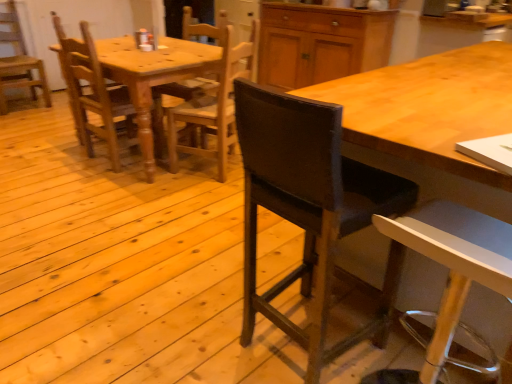
Question: From the image's perspective, is wooden desk at center above or below dark brown leather chair at center, which is counted as the fourth chair, starting from the left?

Choices:
 (A) above
 (B) below

Answer: (A)

Question: Does point (453, 62) appear closer or farther from the camera than point (287, 173)?

Choices:
 (A) farther
 (B) closer

Answer: (A)

Question: Which object is positioned farthest from the wooden chair at center, positioned as the fourth chair in right-to-left order?

Choices:
 (A) wooden chair at center, acting as the 3th chair starting from the right
 (B) white plastic stool at lower right, arranged as the first chair when viewed from the right
 (C) wooden chair at left, placed as the 1th chair when sorted from left to right
 (D) dark brown leather chair at center, which is counted as the fourth chair, starting from the left
 (E) wooden desk at center

Answer: (B)

Question: Which object is positioned farthest from the wooden chair at left, placed as the 5th chair when sorted from right to left?

Choices:
 (A) white plastic stool at lower right, marked as the 5th chair in a back-to-front arrangement
 (B) wooden desk at center
 (C) matte wood cabinet at upper center
 (D) wooden chair at center, the third chair positioned from the front
 (E) dark brown leather chair at center, acting as the fourth chair starting from the back

Answer: (A)